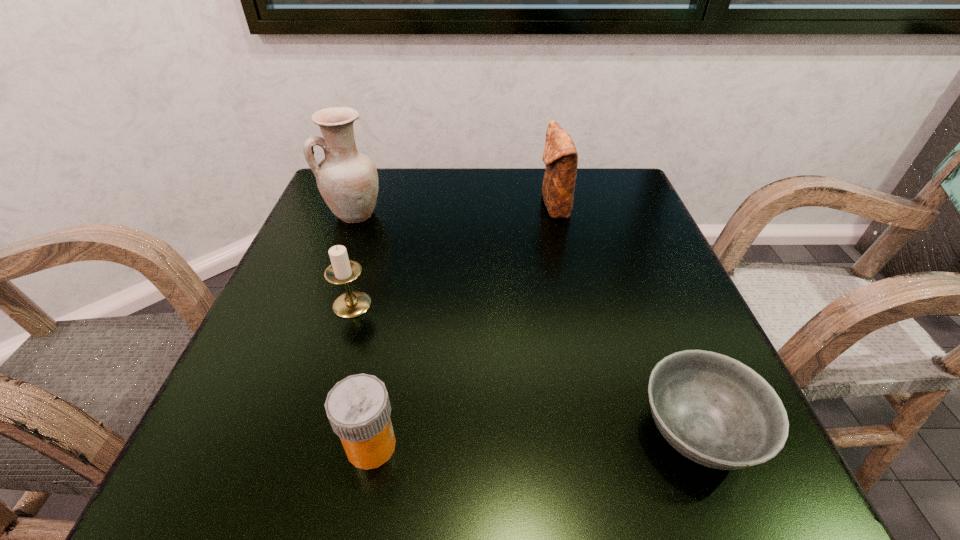
Identify the location of object that is the fourth closest to the medicine. Image resolution: width=960 pixels, height=540 pixels. (560, 156).

The image size is (960, 540). I want to click on the second closest object to the pottery, so click(x=560, y=156).

At what (x,y) coordinates should I click in order to perform the action: click on vacant area that satisfies the following two spatial constraints: 1. on the open side of the fourth shortest object; 2. on the front side of the third tallest object. Please return your answer as a coordinate pair (x, y). Looking at the image, I should click on (576, 305).

Where is `vacant region that satisfies the following two spatial constraints: 1. on the open side of the second tallest object; 2. on the front side of the tallest object`? The width and height of the screenshot is (960, 540). vacant region that satisfies the following two spatial constraints: 1. on the open side of the second tallest object; 2. on the front side of the tallest object is located at coordinates (556, 214).

You are a GUI agent. You are given a task and a screenshot of the screen. Output one action in this format:
    pyautogui.click(x=<x>, y=<y>)
    Task: Click on the free space in the image that satisfies the following two spatial constraints: 1. on the open side of the clutch bag; 2. on the left side of the shortest object
    
    Given the screenshot: What is the action you would take?
    pyautogui.click(x=605, y=432)

The height and width of the screenshot is (540, 960). In order to click on vacant area that satisfies the following two spatial constraints: 1. on the front side of the third nearest object; 2. on the left side of the shortest object in this screenshot , I will do (314, 432).